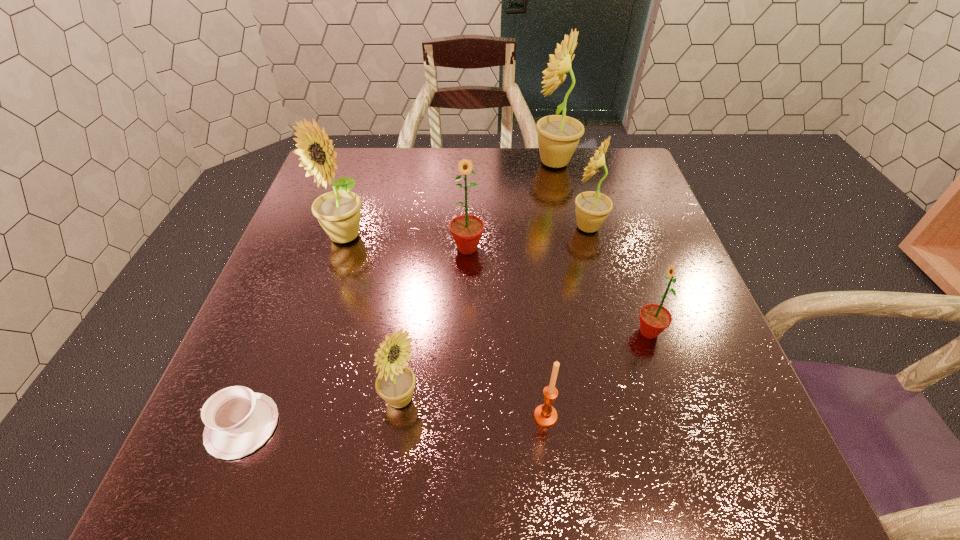
Locate an element on the screen. This screenshot has height=540, width=960. unoccupied area between the farthest sunflower and the nearer green sunflower is located at coordinates (602, 247).

This screenshot has width=960, height=540. Find the location of `vacant region between the fourth object from right to left and the smaller green sunflower`. vacant region between the fourth object from right to left and the smaller green sunflower is located at coordinates (597, 374).

Find the location of a particular element. The image size is (960, 540). empty location between the leftmost yellow sunflower and the farther green sunflower is located at coordinates (406, 242).

At what (x,y) coordinates should I click in order to perform the action: click on free spot between the farthest sunflower and the shortest object. Please return your answer as a coordinate pair (x, y). Looking at the image, I should click on (398, 294).

What are the coordinates of `vacant region between the leftmost yellow sunflower and the right green sunflower` in the screenshot? It's located at (496, 284).

Identify which object is the seventh closest to the third biggest yellow sunflower. Please provide its 2D coordinates. Your answer should be formatted as a tuple, i.e. [(x, y)], where the tuple contains the x and y coordinates of a point satisfying the conditions above.

[(238, 421)]

Select which object appears as the sixth closest to the candle_holder. Please provide its 2D coordinates. Your answer should be formatted as a tuple, i.e. [(x, y)], where the tuple contains the x and y coordinates of a point satisfying the conditions above.

[(338, 212)]

Locate an element on the screen. Image resolution: width=960 pixels, height=540 pixels. sunflower that is the fifth closest to the teacup is located at coordinates (592, 208).

Find the location of `sunflower that is the second closest to the shortest object`. sunflower that is the second closest to the shortest object is located at coordinates (338, 212).

What are the coordinates of `yellow sunflower that can be found as the closest to the fourth object from right to left` in the screenshot? It's located at (395, 383).